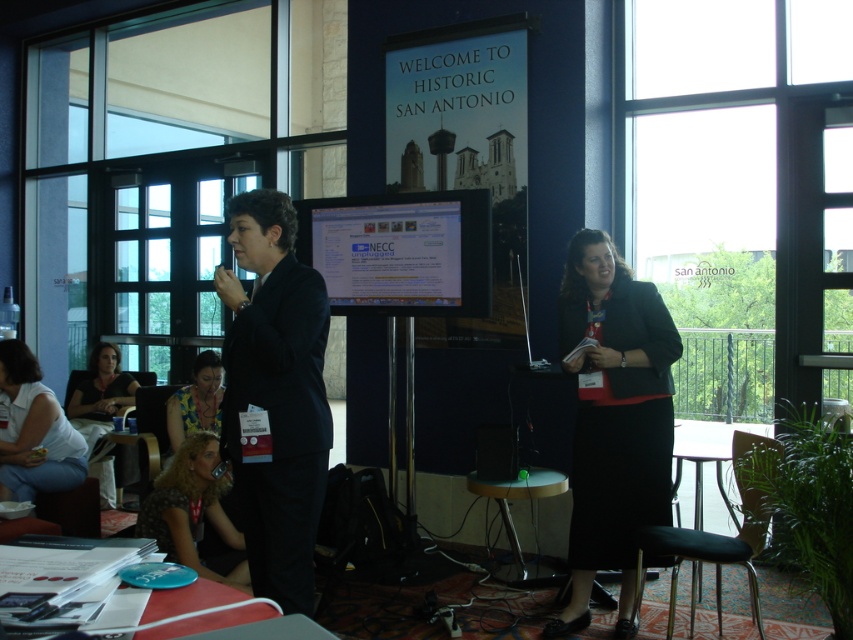
Can you confirm if black suit at center is smaller than matte black shirt at lower left?

Correct, black suit at center occupies less space than matte black shirt at lower left.

Between point (262, 268) and point (108, 420), which one is positioned behind?

Point (108, 420)

The width and height of the screenshot is (853, 640). I want to click on black suit at center, so click(276, 396).

Locate an element on the screen. matte black shirt at lower left is located at coordinates (100, 394).

Is point (3, 390) less distant than point (187, 429)?

Yes, it is.

Between white fabric shirt at lower left and yellow floral dress at lower left, which one appears on the left side from the viewer's perspective?

white fabric shirt at lower left

Does point (22, 470) come farther from viewer compared to point (218, 412)?

No, it is in front of (218, 412).

I want to click on white fabric shirt at lower left, so click(x=33, y=429).